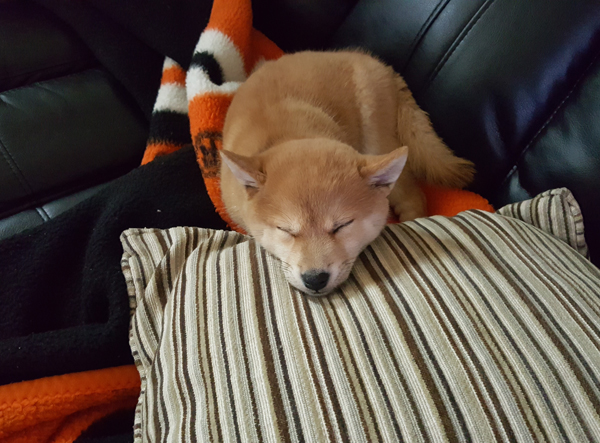
You are a GUI agent. You are given a task and a screenshot of the screen. Output one action in this format:
    pyautogui.click(x=<x>, y=<y>)
    Task: Click on the chair seat
    
    Given the screenshot: What is the action you would take?
    pyautogui.click(x=55, y=121)